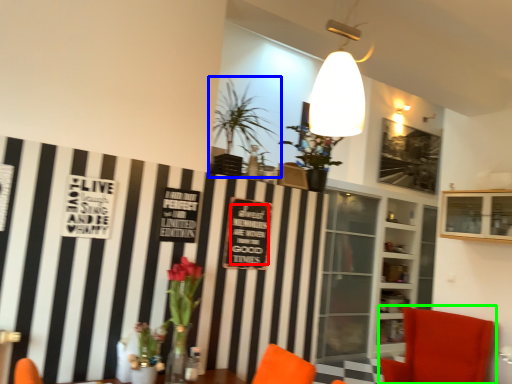
Question: Estimate the real-world distances between objects in this image. Which object is closer to writing (highlighted by a red box), houseplant (highlighted by a blue box) or chair (highlighted by a green box)?

Choices:
 (A) houseplant
 (B) chair

Answer: (A)